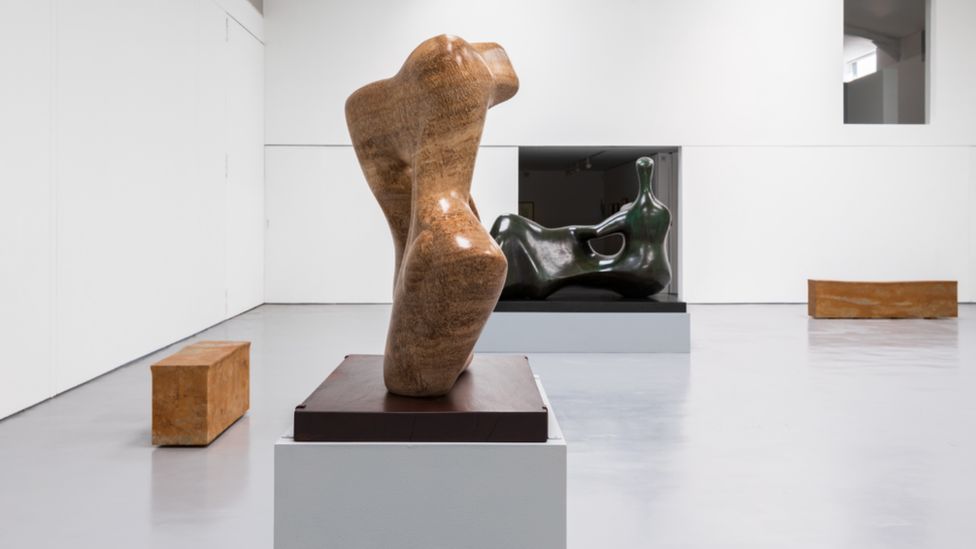
This screenshot has width=976, height=549. In order to click on pedestal under green sculpture in this screenshot , I will do `click(592, 337)`.